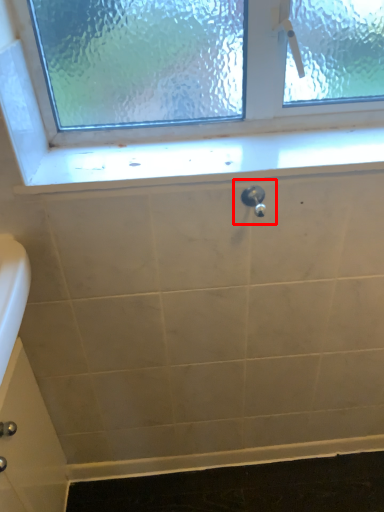
Question: From the image's perspective, what is the correct spatial positioning of plumbing fixture (annotated by the red box) in reference to window sill?

Choices:
 (A) above
 (B) below

Answer: (B)